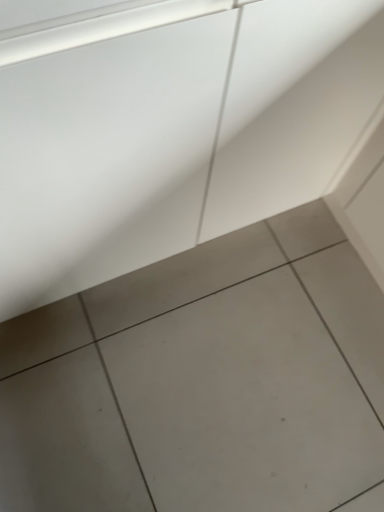
Question: From the image's perspective, is gray matte tile at center located above or below white smooth concrete at center?

Choices:
 (A) above
 (B) below

Answer: (B)

Question: Is gray matte tile at center inside the boundaries of white smooth concrete at center, or outside?

Choices:
 (A) inside
 (B) outside

Answer: (B)

Question: From a real-world perspective, is gray matte tile at center above or below white smooth concrete at center?

Choices:
 (A) below
 (B) above

Answer: (A)

Question: Based on their sizes in the image, would you say white smooth concrete at center is bigger or smaller than gray matte tile at center?

Choices:
 (A) small
 (B) big

Answer: (B)

Question: Is white smooth concrete at center taller or shorter than gray matte tile at center?

Choices:
 (A) short
 (B) tall

Answer: (B)

Question: Considering the positions of point (380, 56) and point (148, 369), is point (380, 56) closer or farther from the camera than point (148, 369)?

Choices:
 (A) farther
 (B) closer

Answer: (B)

Question: From the image's perspective, is white smooth concrete at center located above or below gray matte tile at center?

Choices:
 (A) above
 (B) below

Answer: (A)